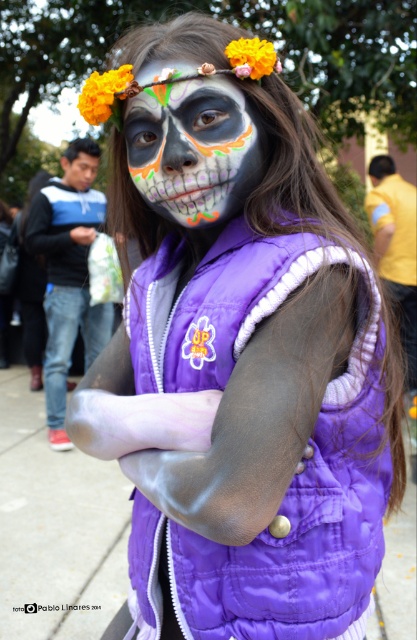
Is orange matte flower at upper left positioned at the back of orange matte flower at upper center?

Yes, it is.

Does orange matte flower at upper left appear on the left side of orange matte flower at upper center?

Yes, orange matte flower at upper left is to the left of orange matte flower at upper center.

Locate an element on the screen. The width and height of the screenshot is (417, 640). orange matte flower at upper left is located at coordinates (102, 92).

Based on the photo, between matte black face paint at center and orange matte flower at upper center, which one has less height?

Standing shorter between the two is orange matte flower at upper center.

Who is more forward, [255,180] or [253,52]?

Point [253,52] is in front.

Does point (211, 160) come in front of point (263, 44)?

Yes, it is.

Where is `matte black face paint at center`? The image size is (417, 640). matte black face paint at center is located at coordinates (190, 145).

Is the position of matte black face paint at center less distant than that of orange matte flower at upper left?

Yes, it is.

Does point (150, 99) lie behind point (90, 83)?

That is False.

Where is `matte black face paint at center`? matte black face paint at center is located at coordinates (190, 145).